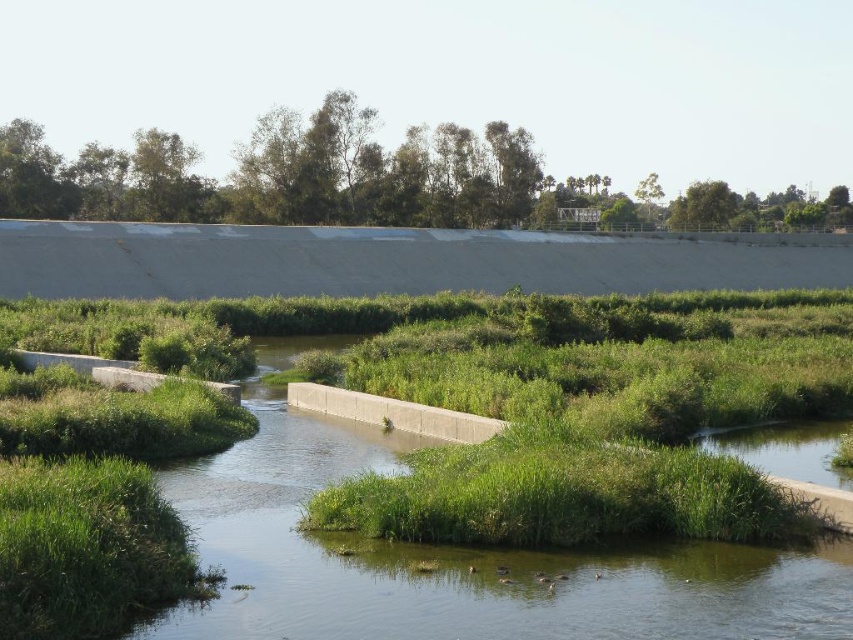
You are standing at the point marked by point (456, 561) in the image. What is directly beneath your feet?

The point (456, 561) marks the green grassy river at center, so the ground beneath your feet is the green grassy river at center.

You are standing at the edge of the green grassy river at center and looking towards the green leafy trees at upper center. Which object is taller between the two?

The green leafy trees at upper center are taller than the green grassy river at center.

In the scene shown: You are a landscape architect designing a new park and want to incorporate both the green grassy river at center and the green leafy trees at upper center. Based on their sizes, which one should be placed closer to the entrance to make it more prominent?

The green leafy trees at upper center should be placed closer to the entrance because they are larger than the green grassy river at center, making them more prominent.